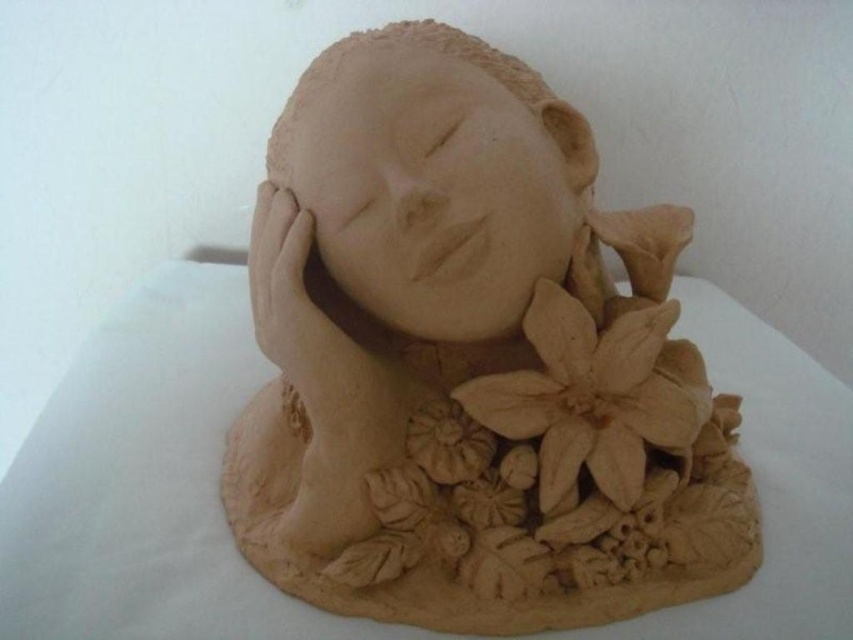
Does matte clay head at center have a lesser height compared to brown matte flower at center-right?

Incorrect, matte clay head at center's height does not fall short of brown matte flower at center-right's.

Does point (447, 289) lie behind point (547, 330)?

No, it is not.

Between point (328, 122) and point (508, 417), which one is positioned behind?

Point (508, 417)

The height and width of the screenshot is (640, 853). Identify the location of matte clay head at center. (434, 177).

Who is more distant from viewer, (532, 314) or (288, 196)?

Point (288, 196)

Does brown matte flower at center-right have a lesser height compared to matte clay hand at center?

Yes.

Is point (576, 388) in front of point (309, 356)?

No, (576, 388) is behind (309, 356).

Where is `brown matte flower at center-right`? brown matte flower at center-right is located at coordinates (595, 396).

At what (x,y) coordinates should I click in order to perform the action: click on matte clay hand at center. Please return your answer as a coordinate pair (x, y). This screenshot has height=640, width=853. Looking at the image, I should click on (x=299, y=308).

Can you confirm if matte clay hand at center is shorter than brown matte flower at lower center?

In fact, matte clay hand at center may be taller than brown matte flower at lower center.

Find the location of a particular element. The height and width of the screenshot is (640, 853). matte clay hand at center is located at coordinates (299, 308).

Where is `matte clay hand at center`? matte clay hand at center is located at coordinates (299, 308).